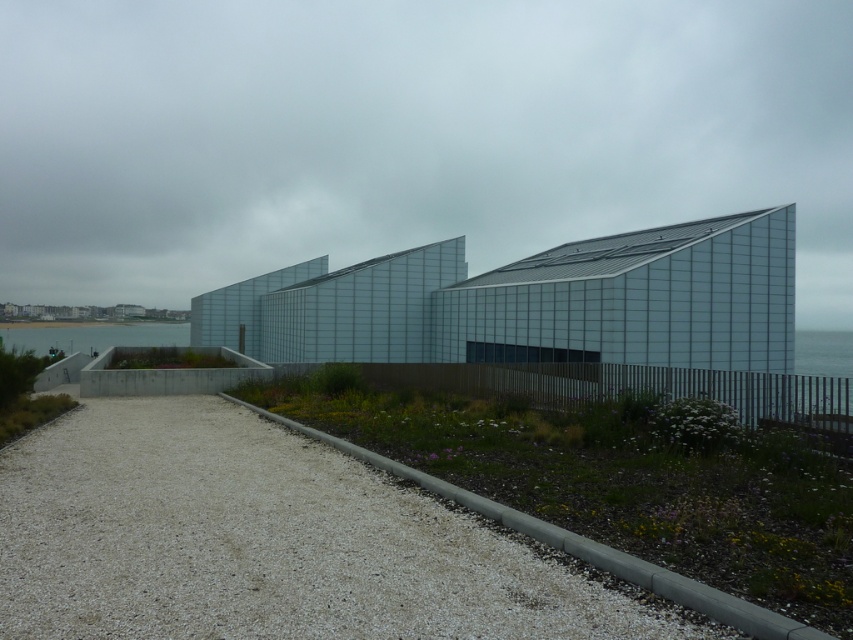
Question: Among these points, which one is nearest to the camera?

Choices:
 (A) (90, 332)
 (B) (318, 621)

Answer: (B)

Question: Is white gravel at lower left behind clear water at lower left?

Choices:
 (A) no
 (B) yes

Answer: (A)

Question: Is white gravel at lower left positioned at the back of clear water at lower left?

Choices:
 (A) no
 (B) yes

Answer: (A)

Question: Observing the image, what is the correct spatial positioning of white gravel at lower left in reference to clear water at lower left?

Choices:
 (A) left
 (B) right

Answer: (B)

Question: Which point is farther to the camera?

Choices:
 (A) white gravel at lower left
 (B) clear water at lower left

Answer: (B)